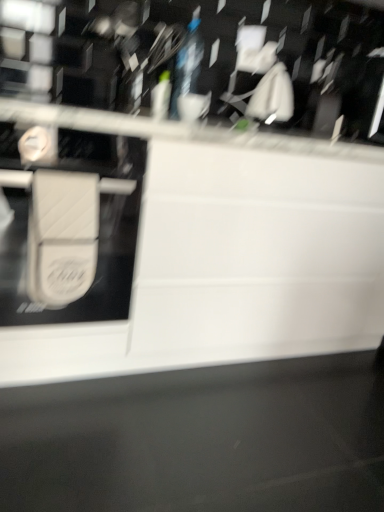
Measure the distance between point (40, 225) and camera.

They are 3.60 feet apart.

Where is `white matte/soft plastic at left`? This screenshot has width=384, height=512. white matte/soft plastic at left is located at coordinates (62, 236).

Describe the element at coordinates (62, 236) in the screenshot. The width and height of the screenshot is (384, 512). I see `white matte/soft plastic at left` at that location.

Describe the element at coordinates (226, 253) in the screenshot. I see `white matte drawer at center` at that location.

I want to click on white matte drawer at center, so click(226, 253).

Locate an element on the screen. The width and height of the screenshot is (384, 512). white matte/soft plastic at left is located at coordinates (62, 236).

Considering the positions of objects white matte drawer at center and white matte/soft plastic at left in the image provided, who is more to the right, white matte drawer at center or white matte/soft plastic at left?

white matte drawer at center is more to the right.

Is white matte drawer at center in front of or behind white matte/soft plastic at left in the image?

Visually, white matte drawer at center is located in front of white matte/soft plastic at left.

Which is farther, (330, 305) or (77, 245)?

The point (330, 305) is more distant.

From the image's perspective, relative to white matte/soft plastic at left, is white matte drawer at center above or below?

From the image's perspective, white matte drawer at center appears above white matte/soft plastic at left.

From a real-world perspective, which object stands above the other?

In real-world perspective, white matte/soft plastic at left is above.

In the scene shown: Considering the sizes of white matte drawer at center and white matte/soft plastic at left in the image, is white matte drawer at center wider or thinner than white matte/soft plastic at left?

Considering their sizes, white matte drawer at center looks broader than white matte/soft plastic at left.

Between white matte drawer at center and white matte/soft plastic at left, which one has more height?

white matte drawer at center is taller.

Can you confirm if white matte drawer at center is bigger than white matte/soft plastic at left?

Indeed, white matte drawer at center has a larger size compared to white matte/soft plastic at left.

Is white matte drawer at center spatially inside white matte/soft plastic at left, or outside of it?

white matte drawer at center is not enclosed by white matte/soft plastic at left.

Would you say white matte drawer at center is a long distance from white matte/soft plastic at left?

They are positioned close to each other.

Is white matte drawer at center positioned with its back to white matte/soft plastic at left?

That's not correct — white matte drawer at center is not looking away from white matte/soft plastic at left.

How different are the orientations of white matte drawer at center and white matte/soft plastic at left in degrees?

5.11 degrees.

Measure the distance between white matte drawer at center and white matte/soft plastic at left.

18.40 inches.

Where is `countertop on the right of white matte/soft plastic at left`? countertop on the right of white matte/soft plastic at left is located at coordinates (226, 253).

Which is more to the left, white matte/soft plastic at left or white matte drawer at center?

white matte/soft plastic at left is more to the left.

Is the position of white matte/soft plastic at left less distant than that of white matte drawer at center?

That is False.

Does point (61, 209) come in front of point (228, 144)?

Yes.

From the image's perspective, which is above, white matte/soft plastic at left or white matte drawer at center?

white matte drawer at center.

In the scene shown: From a real-world perspective, is white matte/soft plastic at left under white matte drawer at center?

Incorrect, from a real-world perspective, white matte/soft plastic at left is higher than white matte drawer at center.

Which object is thinner, white matte/soft plastic at left or white matte drawer at center?

white matte/soft plastic at left is thinner.

Who is taller, white matte/soft plastic at left or white matte drawer at center?

white matte drawer at center is taller.

Can you confirm if white matte/soft plastic at left is bigger than white matte drawer at center?

Incorrect, white matte/soft plastic at left is not larger than white matte drawer at center.

Do you think white matte/soft plastic at left is within white matte drawer at center, or outside of it?

white matte/soft plastic at left cannot be found inside white matte drawer at center.

Is white matte/soft plastic at left beside white matte drawer at center?

No, white matte/soft plastic at left is not touching white matte drawer at center.

Based on the photo, is white matte/soft plastic at left oriented towards white matte drawer at center?

No, white matte/soft plastic at left is not facing towards white matte drawer at center.

Identify the location of countertop above the white matte/soft plastic at left (from the image's perspective). (226, 253).

Identify the location of wide lying behind the white matte drawer at center. (62, 236).

Locate an element on the screen. The width and height of the screenshot is (384, 512). countertop on the right of white matte/soft plastic at left is located at coordinates (226, 253).